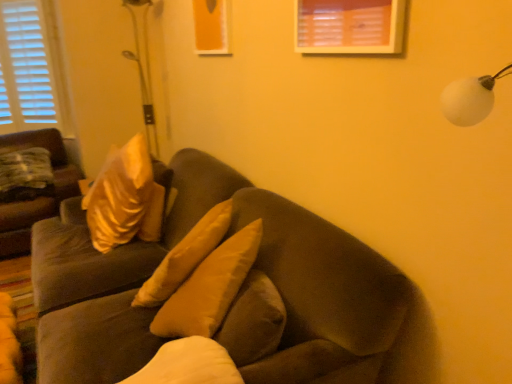
Question: From a real-world perspective, is suede-like brown couch at left, which is the second studio couch from front to back, over suede brown couch at center, acting as the 1th studio couch starting from the front?

Choices:
 (A) no
 (B) yes

Answer: (B)

Question: Is the position of suede-like brown couch at left, the 2th studio couch in the right-to-left sequence, more distant than that of suede brown couch at center, acting as the 1th studio couch starting from the front?

Choices:
 (A) no
 (B) yes

Answer: (B)

Question: Is suede-like brown couch at left, which is the second studio couch from front to back, with suede brown couch at center, the first studio couch viewed from the right?

Choices:
 (A) yes
 (B) no

Answer: (B)

Question: Is suede-like brown couch at left, which is counted as the 1th studio couch, starting from the back, completely or partially outside of suede brown couch at center, the 2th studio couch positioned from the back?

Choices:
 (A) yes
 (B) no

Answer: (A)

Question: Is suede-like brown couch at left, which is counted as the 1th studio couch, starting from the back, aimed at suede brown couch at center, the 2th studio couch positioned from the back?

Choices:
 (A) no
 (B) yes

Answer: (B)

Question: Is suede-like brown couch at left, which is counted as the 1th studio couch, starting from the back, surrounding suede brown couch at center, acting as the second studio couch starting from the left?

Choices:
 (A) yes
 (B) no

Answer: (B)

Question: Is suede brown couch at center, the first studio couch viewed from the right, positioned with its back to suede-like brown couch at left, which is the second studio couch from front to back?

Choices:
 (A) no
 (B) yes

Answer: (A)

Question: Considering the relative sizes of suede brown couch at center, the first studio couch viewed from the right, and suede-like brown couch at left, which is the second studio couch from front to back, in the image provided, is suede brown couch at center, the first studio couch viewed from the right, smaller than suede-like brown couch at left, which is the second studio couch from front to back,?

Choices:
 (A) yes
 (B) no

Answer: (B)

Question: From a real-world perspective, is suede brown couch at center, acting as the second studio couch starting from the left, located beneath suede-like brown couch at left, which is the second studio couch from front to back?

Choices:
 (A) yes
 (B) no

Answer: (A)

Question: Does suede brown couch at center, the 2th studio couch positioned from the back, appear on the right side of suede-like brown couch at left, which is the first studio couch from left to right?

Choices:
 (A) no
 (B) yes

Answer: (B)

Question: From a real-world perspective, is suede brown couch at center, the 2th studio couch positioned from the back, over suede-like brown couch at left, which is the second studio couch from front to back?

Choices:
 (A) no
 (B) yes

Answer: (A)

Question: Is the surface of suede brown couch at center, acting as the second studio couch starting from the left, in direct contact with suede-like brown couch at left, which is counted as the 1th studio couch, starting from the back?

Choices:
 (A) yes
 (B) no

Answer: (B)

Question: From the image's perspective, is suede-like brown couch at left, the 2th studio couch in the right-to-left sequence, beneath satin gold pillow at left?

Choices:
 (A) yes
 (B) no

Answer: (A)